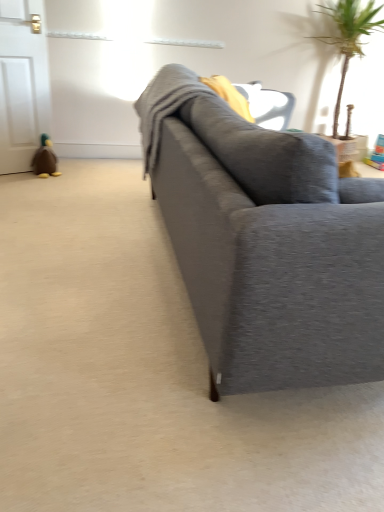
Question: Can you confirm if matte gray couch at center is thinner than brown plush duck at left?

Choices:
 (A) yes
 (B) no

Answer: (B)

Question: Is matte gray couch at center facing towards brown plush duck at left?

Choices:
 (A) no
 (B) yes

Answer: (A)

Question: Does matte gray couch at center have a smaller size compared to brown plush duck at left?

Choices:
 (A) no
 (B) yes

Answer: (A)

Question: From the image's perspective, is matte gray couch at center under brown plush duck at left?

Choices:
 (A) yes
 (B) no

Answer: (A)

Question: Are matte gray couch at center and brown plush duck at left located far from each other?

Choices:
 (A) no
 (B) yes

Answer: (B)

Question: Is green leafy plant at upper right wider or thinner than brown plush duck at left?

Choices:
 (A) thin
 (B) wide

Answer: (B)

Question: Do you think green leafy plant at upper right is within brown plush duck at left, or outside of it?

Choices:
 (A) outside
 (B) inside

Answer: (A)

Question: From their relative heights in the image, would you say green leafy plant at upper right is taller or shorter than brown plush duck at left?

Choices:
 (A) short
 (B) tall

Answer: (B)

Question: Does point (369, 8) appear closer or farther from the camera than point (36, 156)?

Choices:
 (A) farther
 (B) closer

Answer: (A)

Question: Looking at their shapes, would you say brown plush duck at left is wider or thinner than matte gray couch at center?

Choices:
 (A) wide
 (B) thin

Answer: (B)

Question: Based on their sizes in the image, would you say brown plush duck at left is bigger or smaller than matte gray couch at center?

Choices:
 (A) big
 (B) small

Answer: (B)

Question: From the image's perspective, is brown plush duck at left positioned above or below matte gray couch at center?

Choices:
 (A) below
 (B) above

Answer: (B)

Question: Is brown plush duck at left taller or shorter than matte gray couch at center?

Choices:
 (A) tall
 (B) short

Answer: (B)

Question: Considering the positions of point (337, 115) and point (233, 117), is point (337, 115) closer or farther from the camera than point (233, 117)?

Choices:
 (A) closer
 (B) farther

Answer: (B)

Question: In terms of width, does green leafy plant at upper right look wider or thinner when compared to matte gray couch at center?

Choices:
 (A) wide
 (B) thin

Answer: (B)